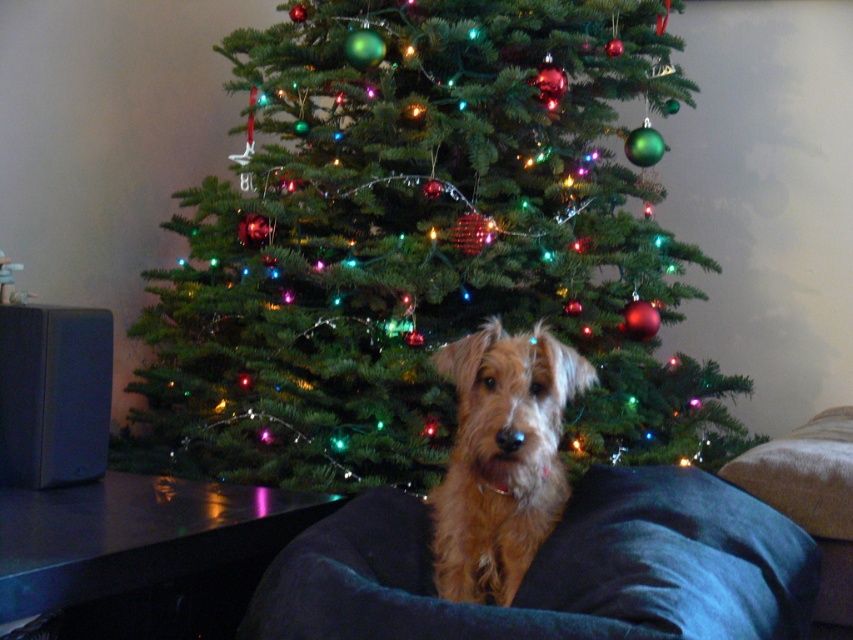
Who is taller, dark blue fabric dog bed at center or brown furry dog at center?

brown furry dog at center

This screenshot has width=853, height=640. Describe the element at coordinates (556, 570) in the screenshot. I see `dark blue fabric dog bed at center` at that location.

Between point (747, 580) and point (548, 416), which one is positioned in front?

Point (747, 580)

This screenshot has width=853, height=640. What are the coordinates of `dark blue fabric dog bed at center` in the screenshot? It's located at (556, 570).

Which is in front, point (422, 468) or point (476, 369)?

Point (476, 369) is in front.

Is green matte christmas tree at center to the right of brown furry dog at center from the viewer's perspective?

In fact, green matte christmas tree at center is to the left of brown furry dog at center.

Who is more distant from viewer, (296, 150) or (544, 376)?

Positioned behind is point (296, 150).

This screenshot has height=640, width=853. I want to click on green matte christmas tree at center, so click(x=424, y=244).

Can you confirm if green matte christmas tree at center is positioned above dark blue fabric dog bed at center?

Yes.

Who is more forward, [219,472] or [352,570]?

Point [352,570] is in front.

Image resolution: width=853 pixels, height=640 pixels. I want to click on green matte christmas tree at center, so (424, 244).